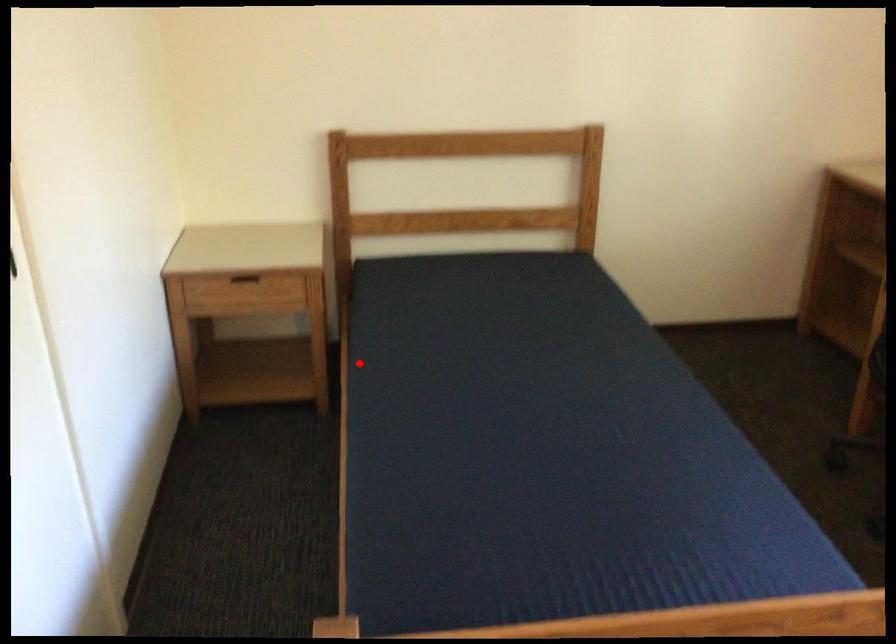
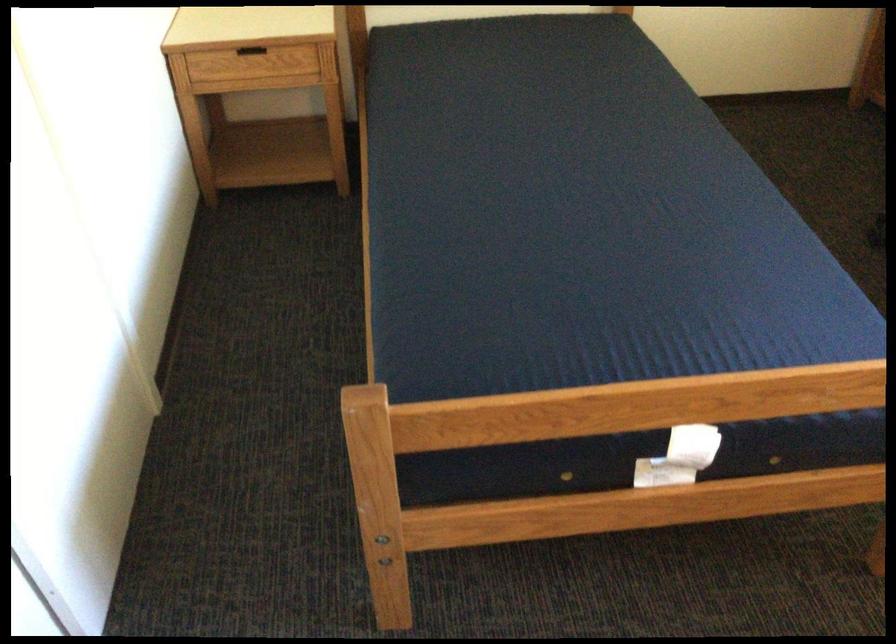
Question: I am providing you with two images of the same scene from different viewpoints. A red point is marked on the first image. At the location where the point appears in image 1, is it still visible in image 2?

Choices:
 (A) Yes
 (B) No

Answer: (A)